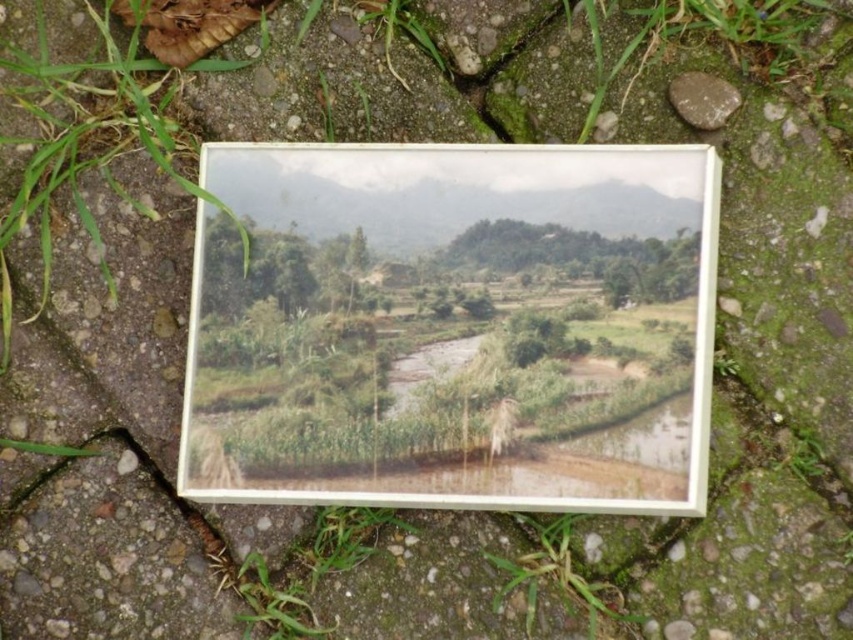
Question: Is matte paper photo at center smaller than brown matte stone at upper right?

Choices:
 (A) yes
 (B) no

Answer: (B)

Question: Which object is positioned farthest from the green matte grass at lower center?

Choices:
 (A) green grass at lower left
 (B) matte paper photo at center

Answer: (A)

Question: Based on their relative distances, which object is nearer to the green matte grass at lower center?

Choices:
 (A) matte paper photo at center
 (B) brown matte stone at upper right

Answer: (A)

Question: Is green matte grass at lower center wider than brown matte stone at upper right?

Choices:
 (A) no
 (B) yes

Answer: (B)

Question: Among these points, which one is nearest to the camera?

Choices:
 (A) (345, 230)
 (B) (676, 80)
 (C) (582, 600)
 (D) (245, 570)

Answer: (A)

Question: Does green grass at lower left appear on the right side of brown matte stone at upper right?

Choices:
 (A) yes
 (B) no

Answer: (B)